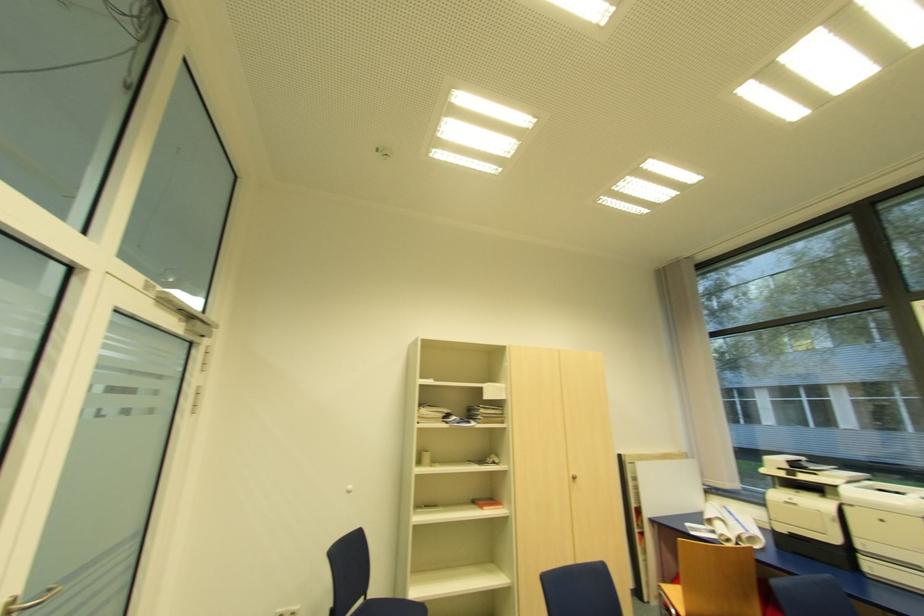
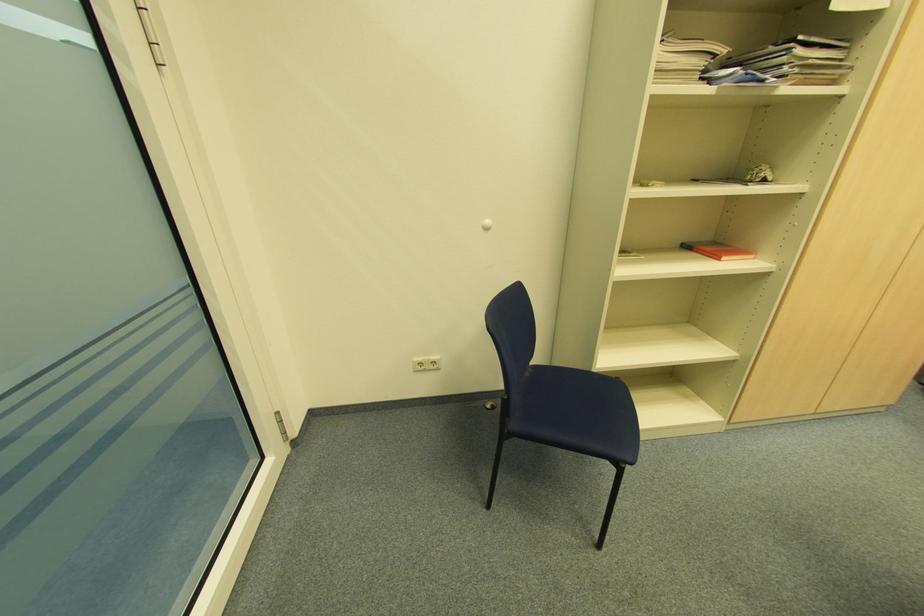
In the second image, find the point that corresponds to point 487,509 in the first image.

(726, 257)